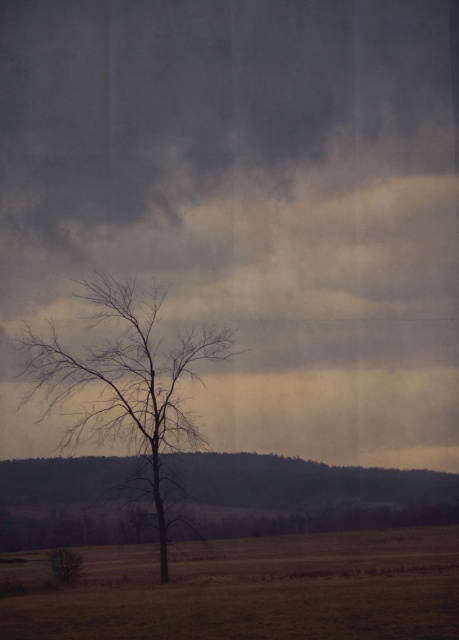
Question: Which point is farther to the camera?

Choices:
 (A) (395, 140)
 (B) (247, 592)
 (C) (128, 339)

Answer: (A)

Question: Among these points, which one is farthest from the camera?

Choices:
 (A) (101, 387)
 (B) (443, 609)
 (C) (426, 13)

Answer: (C)

Question: Is gray matte cloud at upper center further to the viewer compared to bare branches at center?

Choices:
 (A) no
 (B) yes

Answer: (B)

Question: Which is farther from the gray matte cloud at upper center?

Choices:
 (A) bare branches at center
 (B) brown grassland at center

Answer: (B)

Question: Is gray matte cloud at upper center below bare branches at center?

Choices:
 (A) no
 (B) yes

Answer: (A)

Question: Is gray matte cloud at upper center further to the viewer compared to bare branches at center?

Choices:
 (A) no
 (B) yes

Answer: (B)